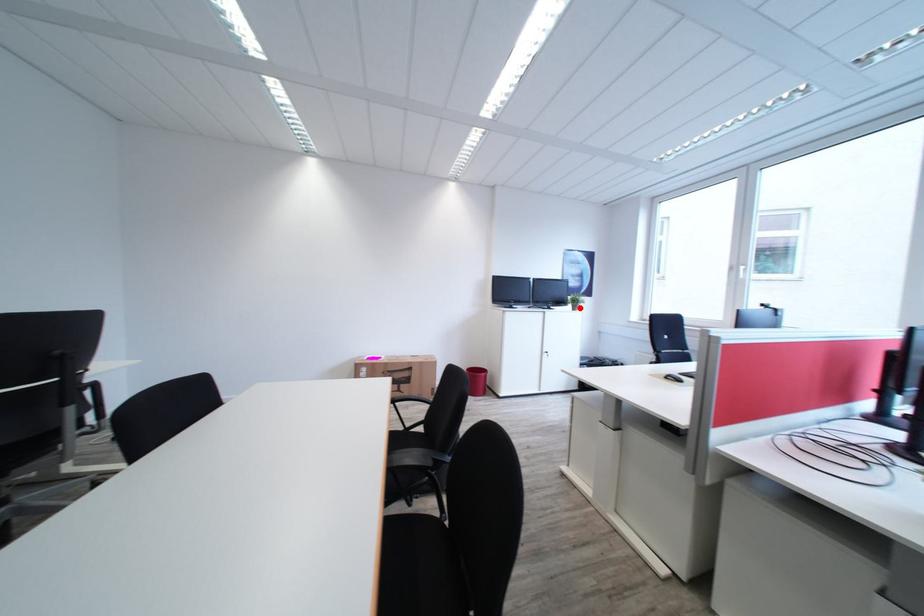
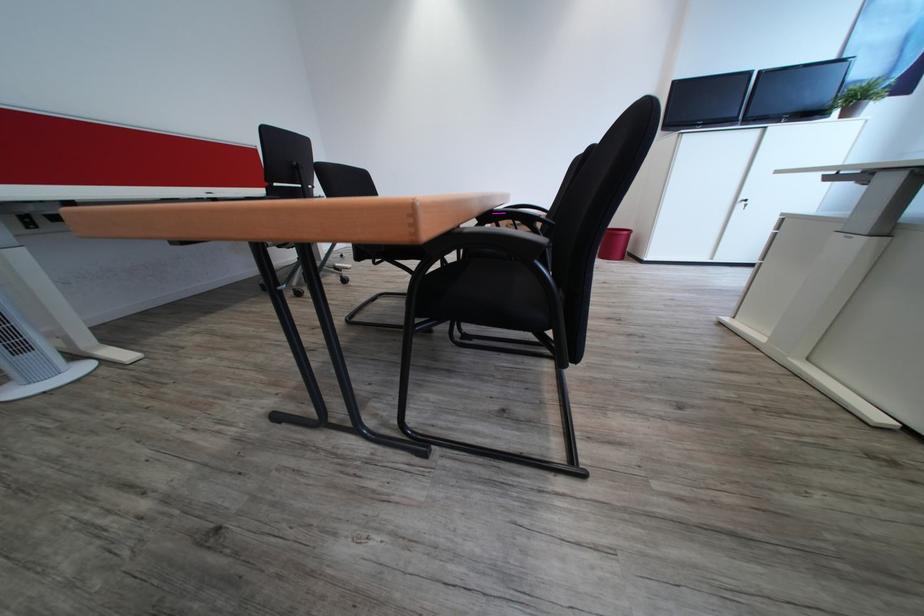
Find the pixel in the second image that matches the highlighted location in the first image.

(845, 116)